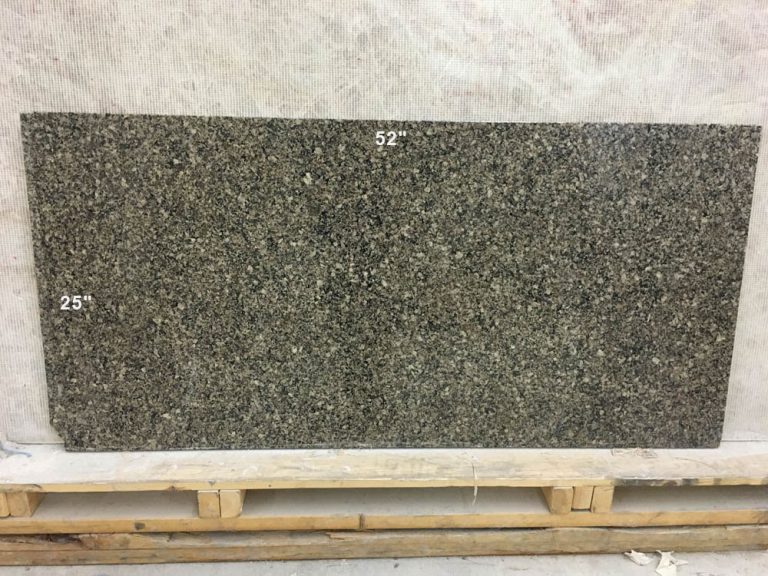
At what (x,y) coordinates should I click in order to perform the action: click on concrete floor. Please return your answer as a coordinate pair (x, y). The height and width of the screenshot is (576, 768). Looking at the image, I should click on (555, 564).